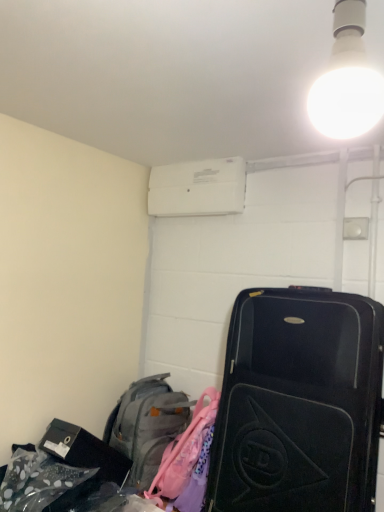
Question: Considering the positions of white plastic air conditioner at upper center and gray fabric backpack at lower left in the image, is white plastic air conditioner at upper center wider or thinner than gray fabric backpack at lower left?

Choices:
 (A) wide
 (B) thin

Answer: (B)

Question: From a real-world perspective, is white plastic air conditioner at upper center physically located above or below gray fabric backpack at lower left?

Choices:
 (A) below
 (B) above

Answer: (B)

Question: Considering the real-world distances, which object is farthest from the black hardshell suitcase at right?

Choices:
 (A) white plastic air conditioner at upper center
 (B) gray fabric backpack at lower left
 (C) white glossy bulb at upper right

Answer: (C)

Question: Estimate the real-world distances between objects in this image. Which object is farther from the white plastic air conditioner at upper center?

Choices:
 (A) gray fabric backpack at lower left
 (B) black hardshell suitcase at right
 (C) white glossy bulb at upper right

Answer: (C)